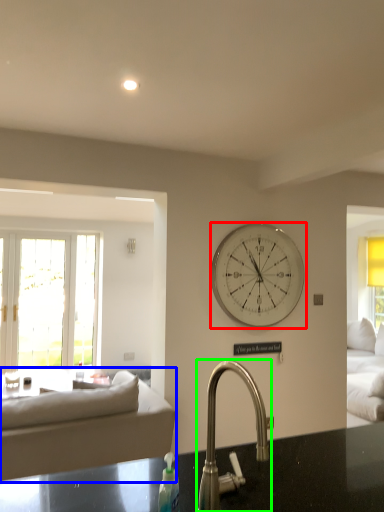
Question: Which object is the farthest from wall clock (highlighted by a red box)? Choose among these: studio couch (highlighted by a blue box) or tap (highlighted by a green box).

Choices:
 (A) studio couch
 (B) tap

Answer: (B)